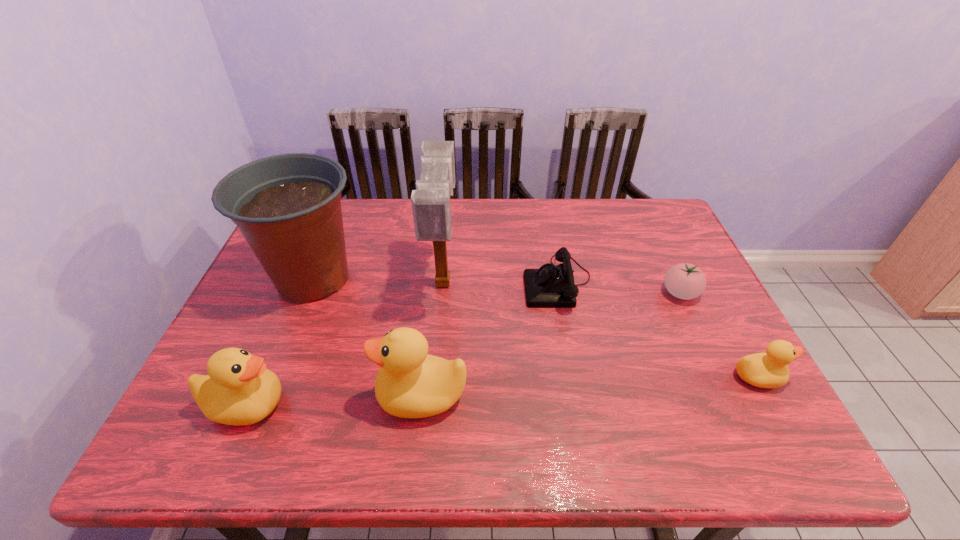
To ensure equal spacing by inserting another duck among them, please point out a vacant spot for this new duck. Please provide its 2D coordinates. Your answer should be formatted as a tuple, i.e. [(x, y)], where the tuple contains the x and y coordinates of a point satisfying the conditions above.

[(592, 386)]